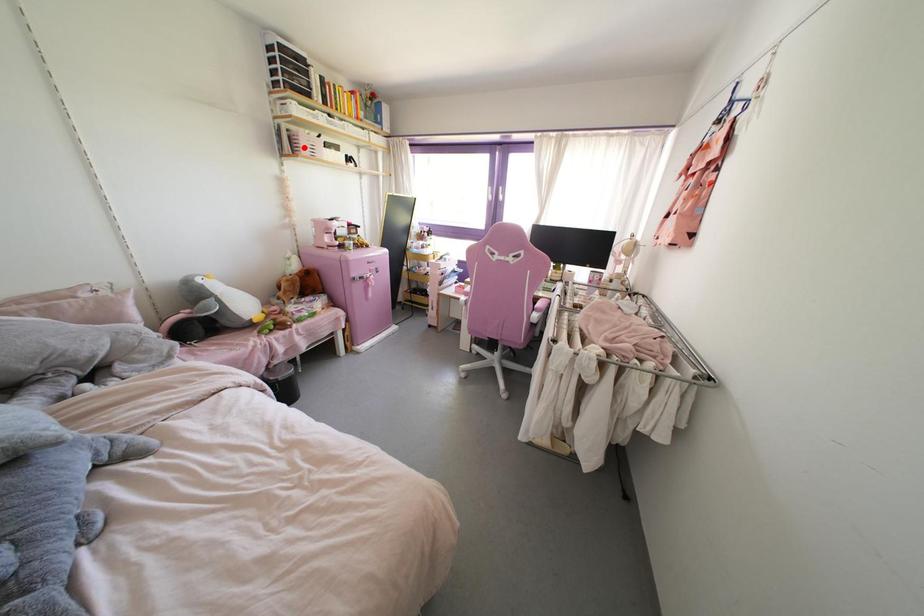
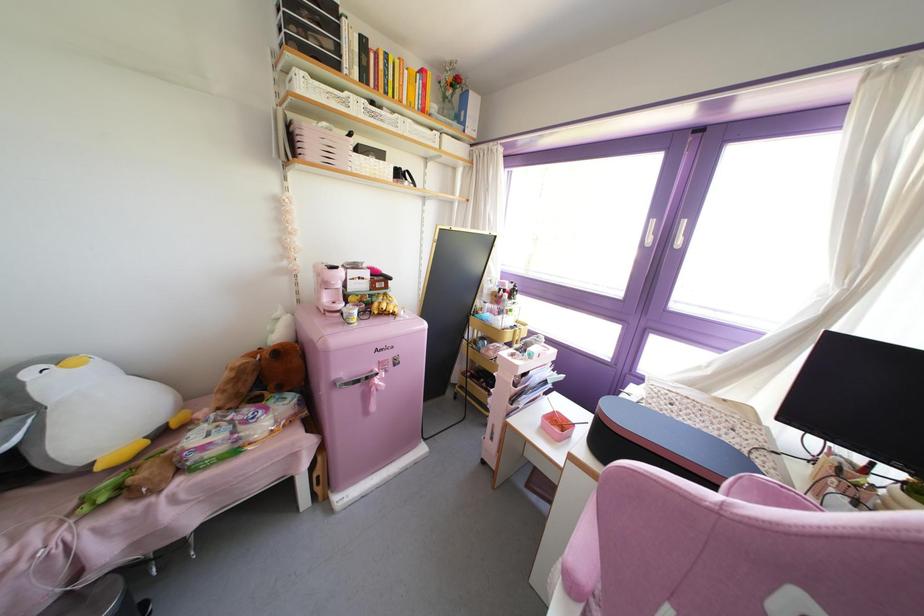
Question: I am providing you with two images of the same scene from different viewpoints. A red point is marked on the first image. Is the red point's position out of view in image 2?

Choices:
 (A) Yes
 (B) No

Answer: (B)